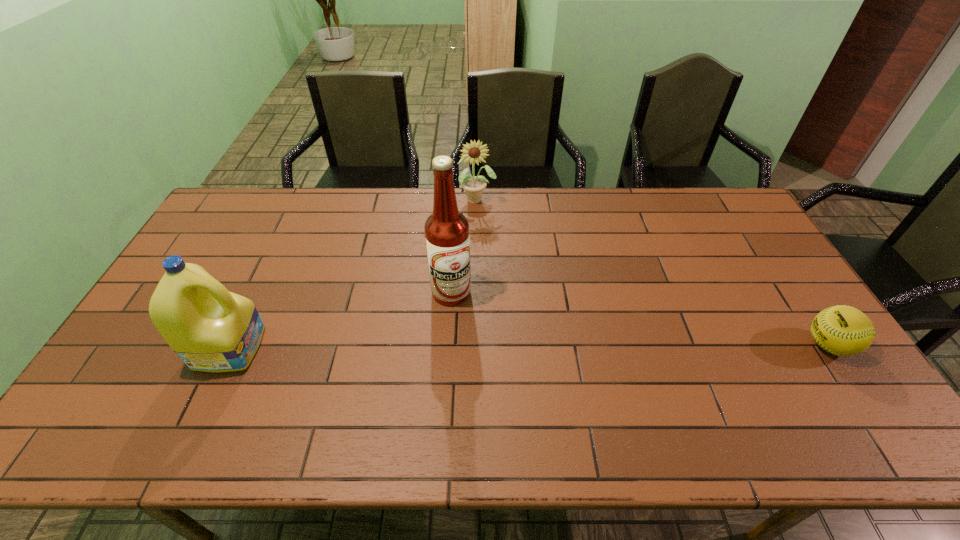
Where is `vacant point located on the logo side of the rightmost object`? Image resolution: width=960 pixels, height=540 pixels. vacant point located on the logo side of the rightmost object is located at coordinates (733, 345).

Identify the location of free space located on the logo side of the rightmost object. This screenshot has width=960, height=540. (666, 345).

Find the location of a particular element. free space located 0.070m on the label side of the second farthest object is located at coordinates (479, 318).

Locate an element on the screen. This screenshot has height=540, width=960. free spot located on the label side of the second farthest object is located at coordinates (477, 316).

Where is `free space located 0.140m on the label side of the second farthest object`? free space located 0.140m on the label side of the second farthest object is located at coordinates (495, 333).

Where is `vacant space situated on the front-facing side of the sunflower`? vacant space situated on the front-facing side of the sunflower is located at coordinates (480, 235).

At what (x,y) coordinates should I click in order to perform the action: click on vacant space located on the front-facing side of the sunflower. Please return your answer as a coordinate pair (x, y). The image size is (960, 540). Looking at the image, I should click on (480, 232).

Where is `vacant region located on the front-facing side of the sunflower`? This screenshot has height=540, width=960. vacant region located on the front-facing side of the sunflower is located at coordinates (480, 238).

The width and height of the screenshot is (960, 540). I want to click on object situated at the far edge, so click(474, 153).

At what (x,y) coordinates should I click in order to perform the action: click on object at the near edge. Please return your answer as a coordinate pair (x, y). The image size is (960, 540). Looking at the image, I should click on (211, 329).